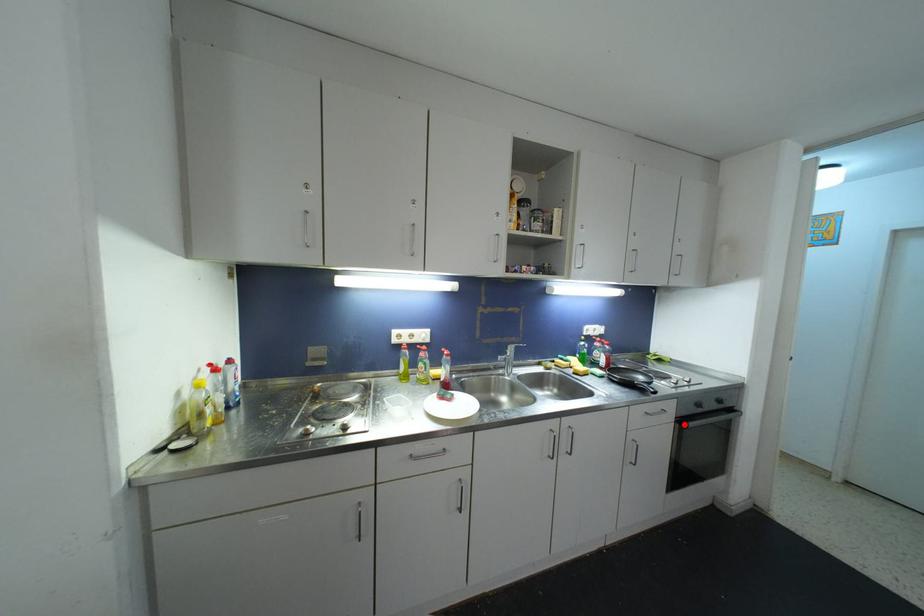
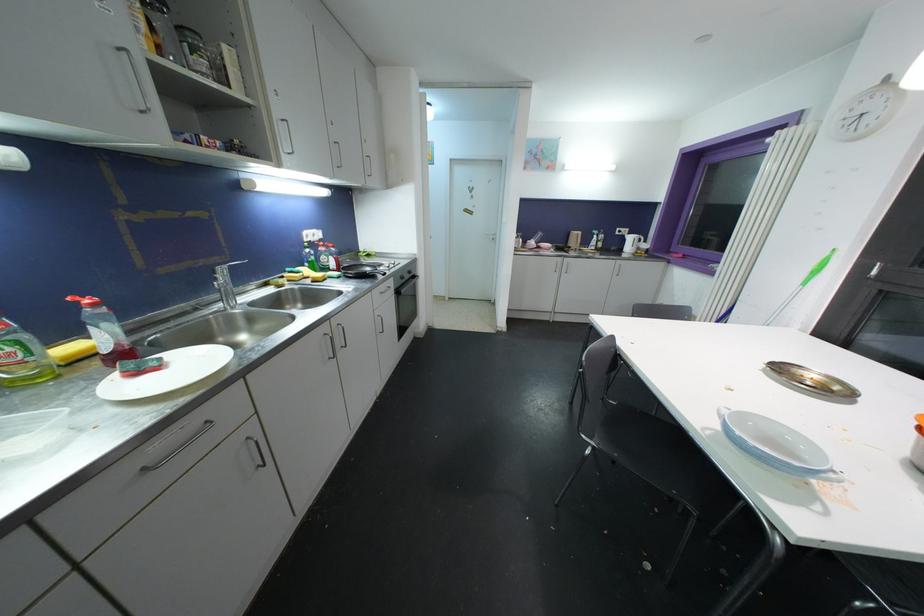
Question: I am providing you with two images of the same scene from different viewpoints. A red point is marked on the first image. Can you still see the location of the red point in image 2?

Choices:
 (A) Yes
 (B) No

Answer: (A)